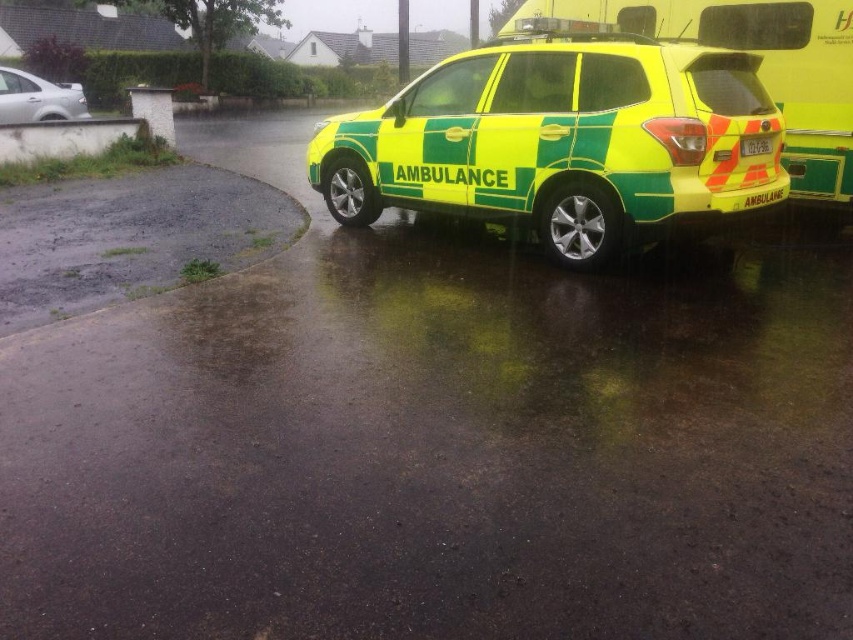
Question: Does high-visibility plastic ambulance at center appear on the right side of satin silver sedan at upper left?

Choices:
 (A) no
 (B) yes

Answer: (B)

Question: Which object appears closest to the camera in this image?

Choices:
 (A) high-visibility plastic ambulance at center
 (B) satin silver sedan at upper left

Answer: (A)

Question: Is high-visibility plastic ambulance at center bigger than satin silver sedan at upper left?

Choices:
 (A) yes
 (B) no

Answer: (A)

Question: Is high-visibility plastic ambulance at center positioned in front of satin silver sedan at upper left?

Choices:
 (A) no
 (B) yes

Answer: (B)